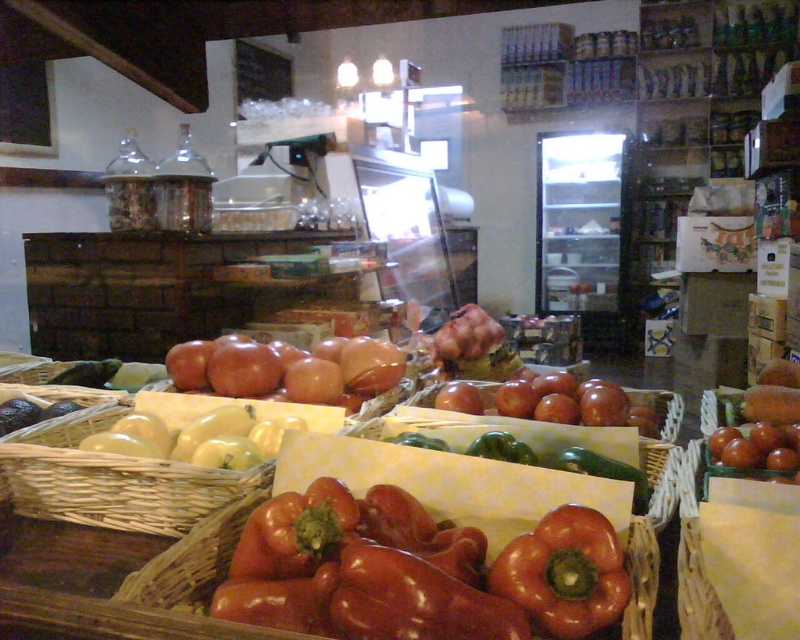
What is the object located at point (564,573) in the image?

The object located at point (564,573) is the shiny red bell pepper at lower center.

You are a customer in the store and want to buy apples. You see the green matte apples at lower left and the matte brown apples at center. Which apples are wider?

The green matte apples at lower left are wider than the matte brown apples at center.

You are a customer in the grocery store and want to buy apples. You see green matte apples at lower left and matte brown apples at center. Which apples are bigger in size?

The green matte apples at lower left are larger in size than the matte brown apples at center.